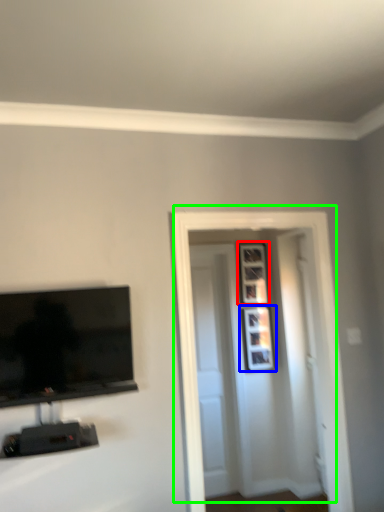
Question: Estimate the real-world distances between objects in this image. Which object is farther from picture frame (highlighted by a red box), picture frame (highlighted by a blue box) or door (highlighted by a green box)?

Choices:
 (A) picture frame
 (B) door

Answer: (B)